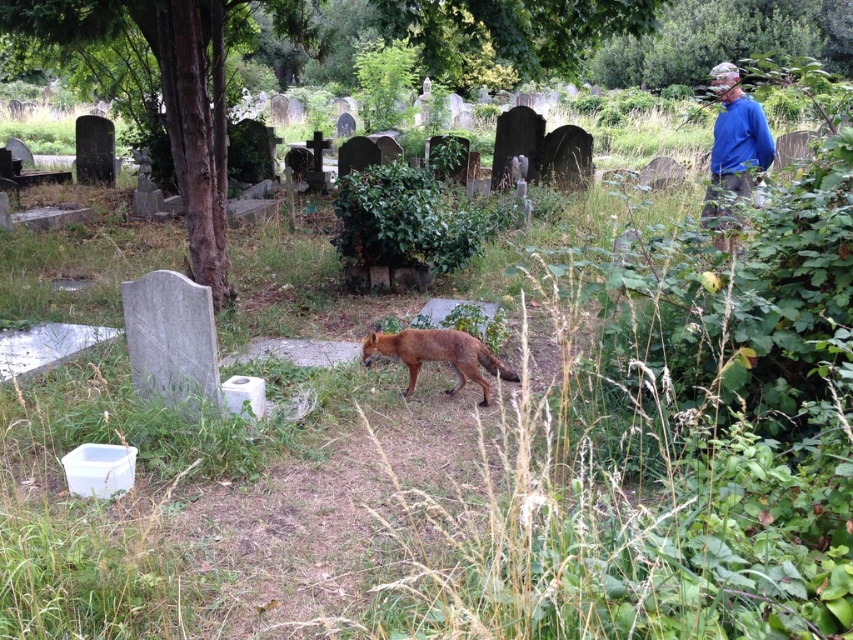
Describe the element at coordinates (171, 92) in the screenshot. I see `green leafy tree at center` at that location.

Between green leafy tree at center and brown fur fox at center, which one has more height?

green leafy tree at center

Which is in front, point (552, 51) or point (502, 369)?

Point (502, 369) is in front.

Identify the location of green leafy tree at center. Image resolution: width=853 pixels, height=640 pixels. (171, 92).

Who is more forward, (209, 10) or (750, 145)?

Point (209, 10) is in front.

Find the location of a particular element. The image size is (853, 640). green leafy tree at center is located at coordinates (171, 92).

Between point (724, 148) and point (405, 349), which one is positioned in front?

Point (405, 349) is in front.

Is blue fleece jacket at upper right above brown fur fox at center?

Correct, blue fleece jacket at upper right is located above brown fur fox at center.

Locate an element on the screen. blue fleece jacket at upper right is located at coordinates (737, 132).